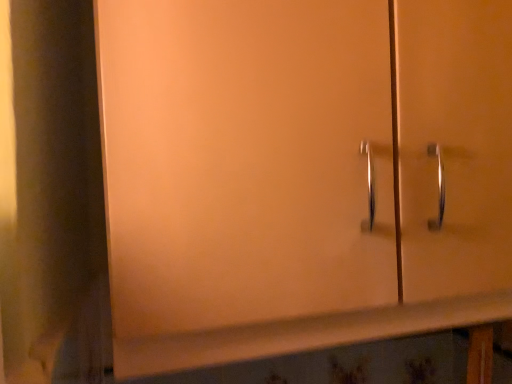
Measure the distance between point (149,229) and camera.

Point (149,229) is 15.35 inches away from camera.

At what (x,y) coordinates should I click in order to perform the action: click on matte wood cabinet at center. Please return your answer as a coordinate pair (x, y). The height and width of the screenshot is (384, 512). Looking at the image, I should click on (243, 177).

In order to face matte wood cabinet at center, should I rotate leftwards or rightwards?

Turn right by 11.094 degrees to look at matte wood cabinet at center.

Image resolution: width=512 pixels, height=384 pixels. Describe the element at coordinates (243, 177) in the screenshot. I see `matte wood cabinet at center` at that location.

Find the location of a particular element. matte wood cabinet at center is located at coordinates (243, 177).